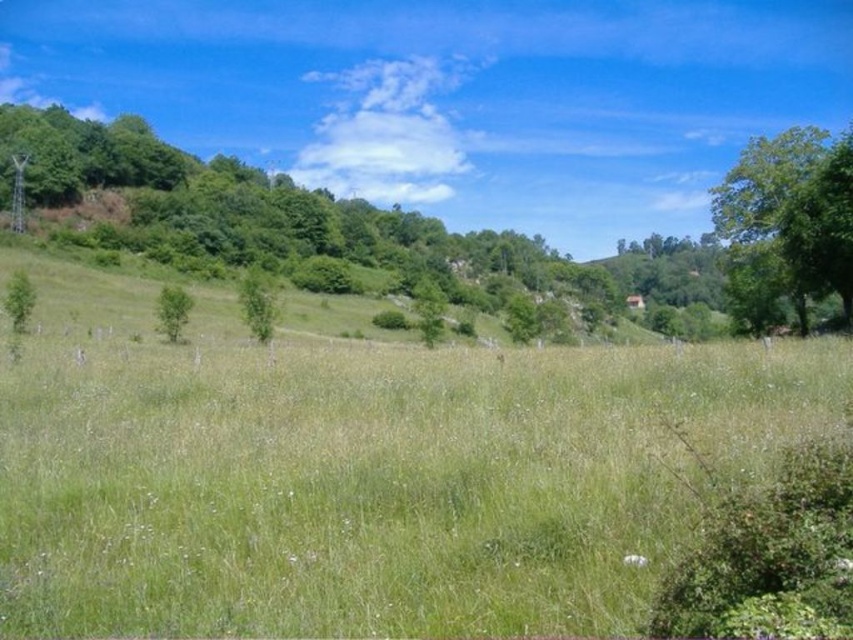
You are standing in the rural landscape and want to find the tallest tree among the green leafy tree at right and the green leafy tree at center. Which one should you look towards?

The green leafy tree at right is taller than the green leafy tree at center, so you should look towards the green leafy tree at right.